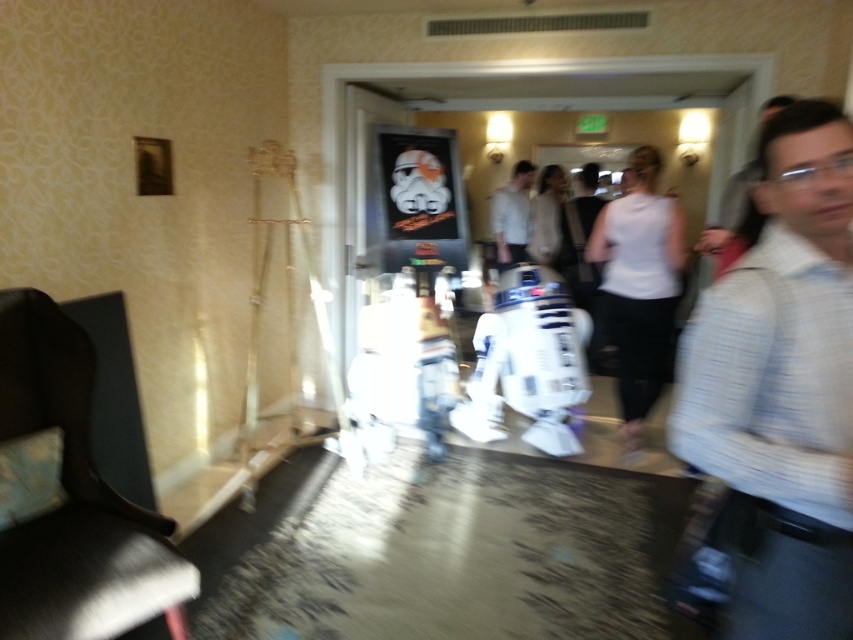
You are organizing a clothing display and need to arrange the white textured shirt at right and the white matte shirt at center based on their sizes. Which shirt should you place first if you want to arrange them from smallest to largest?

The white textured shirt at right has a smaller size compared to the white matte shirt at center, so you should place the white textured shirt at right first in the arrangement from smallest to largest.

You are standing in the hallway and see the white textured shirt at right. Where exactly is it located in the image?

The white textured shirt at right is located at point coordinates of 0.606 on the x axis and 0.917 on the y axis.

You are a photographer trying to capture a photo of both the white textured shirt at right and the white matte shirt at center. Given that your camera has a maximum focus range of 4 meters, will you be able to capture both subjects in focus at the same time?

The distance between the white textured shirt at right and the white matte shirt at center is 4.22 meters. Since the camera can only focus up to 4 meters, it won not be able to capture both subjects in focus simultaneously.